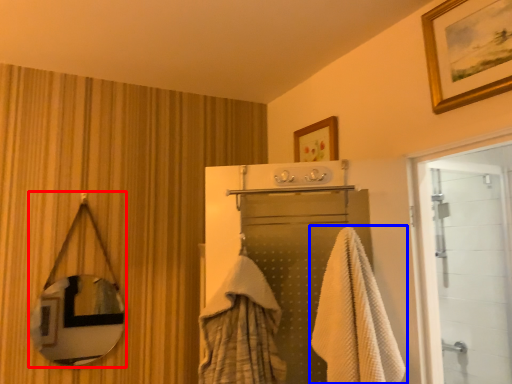
Question: Which point is further to the camera, mirror (highlighted by a red box) or towel (highlighted by a blue box)?

Choices:
 (A) mirror
 (B) towel

Answer: (A)